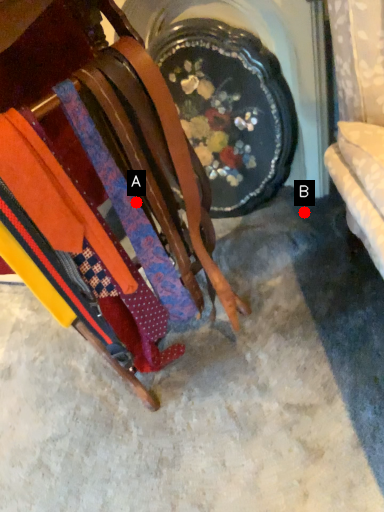
Question: Two points are circled on the image, labeled by A and B beside each circle. Among these points, which one is farthest from the camera?

Choices:
 (A) A is further
 (B) B is further

Answer: (B)